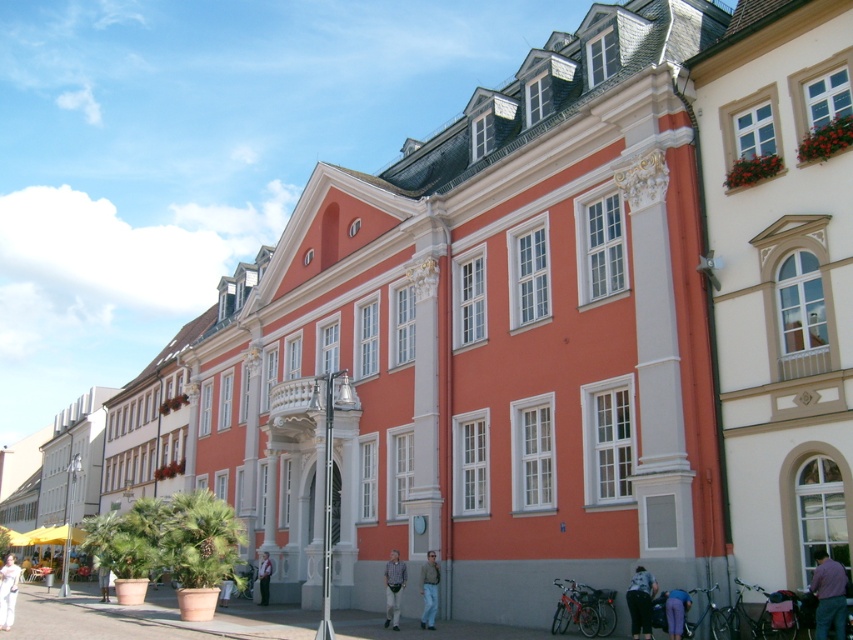
You are standing in front of the vibrant classical building and notice an object labeled dark blue jeans at lower center. Can you provide the exact coordinates of this object?

The dark blue jeans at lower center is located at coordinates point (640, 602).